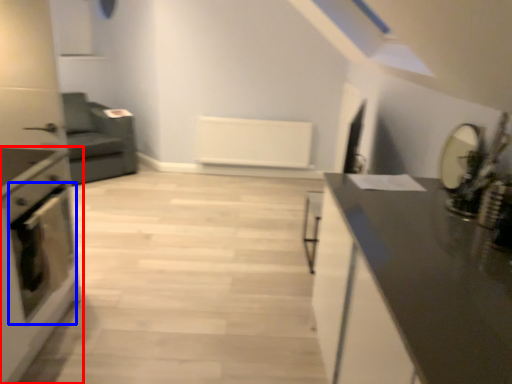
Question: Among these objects, which one is nearest to the camera, home appliance (highlighted by a red box) or oven (highlighted by a blue box)?

Choices:
 (A) home appliance
 (B) oven

Answer: (A)